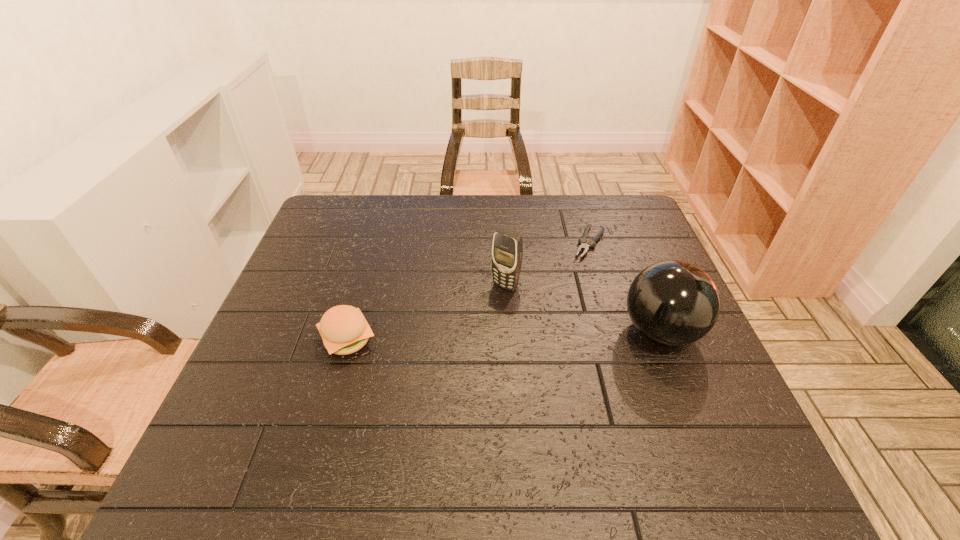
This screenshot has height=540, width=960. What are the coordinates of `free spot between the third tallest object and the shortest object` in the screenshot? It's located at (468, 292).

At what (x,y) coordinates should I click in order to perform the action: click on vacant area that lies between the third nearest object and the shortest object. Please return your answer as a coordinate pair (x, y). This screenshot has width=960, height=540. Looking at the image, I should click on (547, 265).

The width and height of the screenshot is (960, 540). Identify the location of free spot between the leftmost object and the bowling ball. (504, 336).

Locate an element on the screen. This screenshot has height=540, width=960. object that ranks as the second closest to the bowling ball is located at coordinates (507, 250).

Identify which object is the third closest to the bowling ball. Please provide its 2D coordinates. Your answer should be formatted as a tuple, i.e. [(x, y)], where the tuple contains the x and y coordinates of a point satisfying the conditions above.

[(344, 330)]

The width and height of the screenshot is (960, 540). Find the location of `blank space that satisfies the following two spatial constraints: 1. on the back side of the hamburger; 2. on the surface of the bowling ball near the finger holes`. blank space that satisfies the following two spatial constraints: 1. on the back side of the hamburger; 2. on the surface of the bowling ball near the finger holes is located at coordinates (350, 332).

Where is `free point that satisfies the following two spatial constraints: 1. on the back side of the second shortest object; 2. on the surface of the bowling ball near the finger holes`? Image resolution: width=960 pixels, height=540 pixels. free point that satisfies the following two spatial constraints: 1. on the back side of the second shortest object; 2. on the surface of the bowling ball near the finger holes is located at coordinates (350, 332).

Image resolution: width=960 pixels, height=540 pixels. I want to click on free spot that satisfies the following two spatial constraints: 1. on the back side of the second object from left to right; 2. on the right side of the pliers, so coord(503,243).

At what (x,y) coordinates should I click in order to perform the action: click on free space that satisfies the following two spatial constraints: 1. on the front side of the cellular telephone; 2. on the surface of the bowling ball near the finger holes. Please return your answer as a coordinate pair (x, y). Looking at the image, I should click on (509, 332).

Locate an element on the screen. The width and height of the screenshot is (960, 540). vacant space that satisfies the following two spatial constraints: 1. on the front side of the second farthest object; 2. on the surface of the bowling ball near the finger holes is located at coordinates (509, 332).